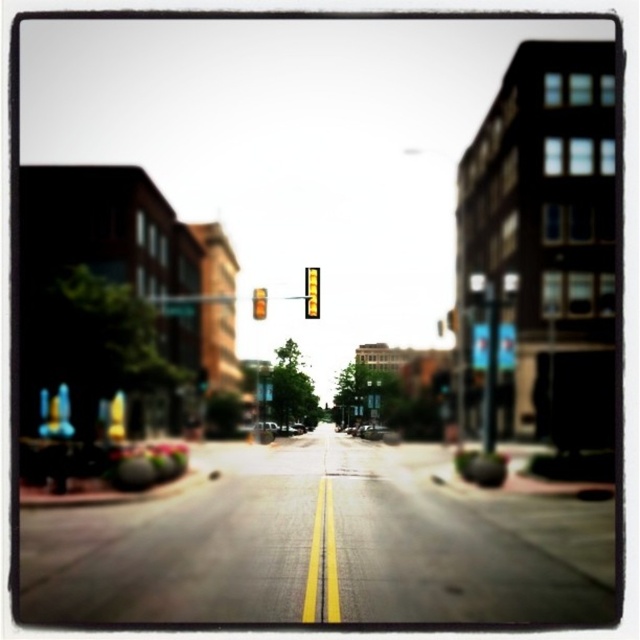
You are driving a car and approaching the intersection. You see the amber glass traffic light at center and the metallic silver car at center. Which object is closer to you as you drive forward?

The amber glass traffic light at center is closer to you because it is in front of the metallic silver car at center.

You are driving a car and see the yellow reflective sign at center and the metallic silver car at center ahead on the road. Which object is narrower when viewed from your perspective?

The yellow reflective sign at center is thinner than the metallic silver car at center, so the yellow reflective sign at center is narrower.